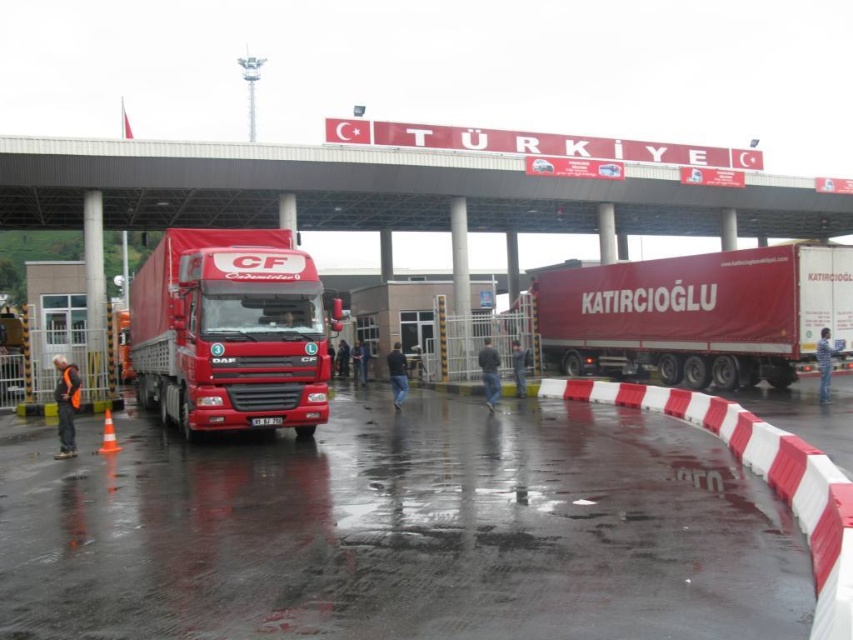
Between concrete bridge at upper center and shiny red truck at center, which one appears on the left side from the viewer's perspective?

shiny red truck at center is more to the left.

Is concrete bridge at upper center wider than shiny red truck at center?

Indeed, concrete bridge at upper center has a greater width compared to shiny red truck at center.

Find the location of a particular element. The image size is (853, 640). concrete bridge at upper center is located at coordinates (380, 192).

Between matte red truck at right and shiny red truck at center, which one appears on the left side from the viewer's perspective?

shiny red truck at center

Where is `matte red truck at right`? Image resolution: width=853 pixels, height=640 pixels. matte red truck at right is located at coordinates (697, 314).

In order to click on matte red truck at right in this screenshot , I will do [x=697, y=314].

Can you confirm if concrete bridge at upper center is positioned to the left of matte red truck at right?

Correct, you'll find concrete bridge at upper center to the left of matte red truck at right.

Between concrete bridge at upper center and matte red truck at right, which one is positioned lower?

matte red truck at right is lower down.

Between point (160, 200) and point (701, 291), which one is positioned in front?

Point (701, 291) is in front.

The image size is (853, 640). Identify the location of concrete bridge at upper center. (380, 192).